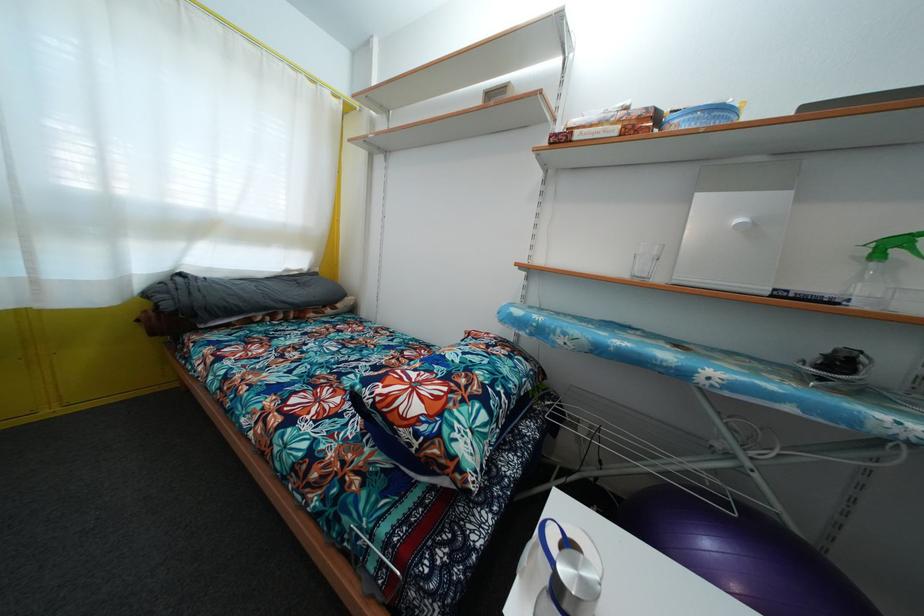
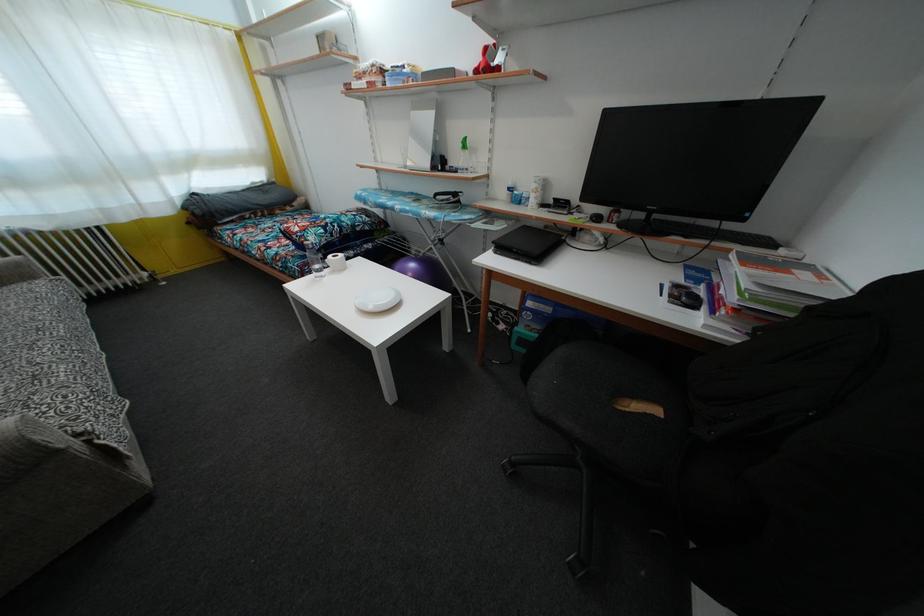
Locate, in the second image, the point that corresponds to point 433,445 in the first image.

(305, 244)